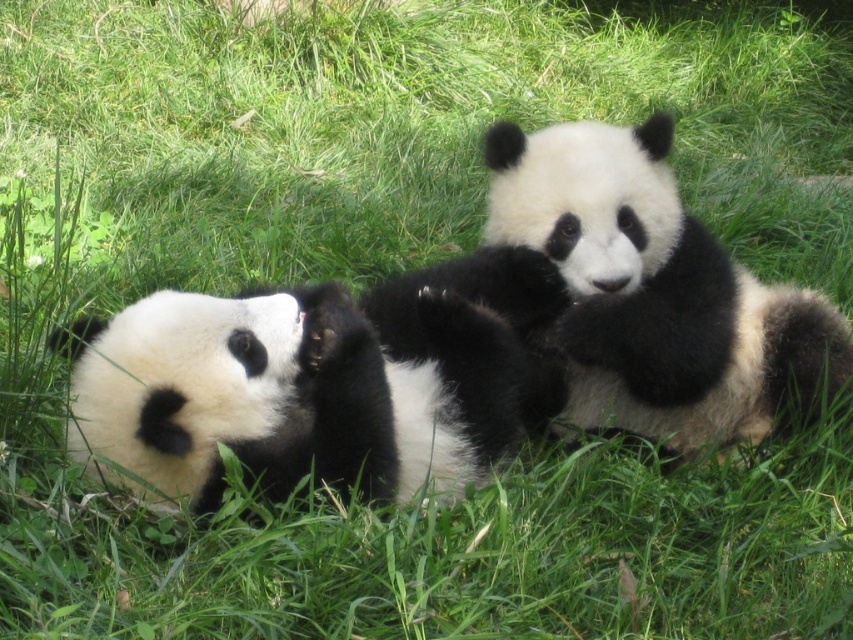
Question: Is the position of soft fur panda at center more distant than that of soft fur panda at left?

Choices:
 (A) no
 (B) yes

Answer: (B)

Question: Which object is farther from the camera taking this photo?

Choices:
 (A) soft fur panda at center
 (B) soft fur panda at left

Answer: (A)

Question: Which point is closer to the camera?

Choices:
 (A) soft fur panda at left
 (B) soft fur panda at center

Answer: (A)

Question: Observing the image, what is the correct spatial positioning of soft fur panda at center in reference to soft fur panda at left?

Choices:
 (A) right
 (B) left

Answer: (A)

Question: Which object appears closest to the camera in this image?

Choices:
 (A) soft fur panda at center
 (B) soft fur panda at left

Answer: (B)

Question: Can you confirm if soft fur panda at center is wider than soft fur panda at left?

Choices:
 (A) no
 (B) yes

Answer: (B)